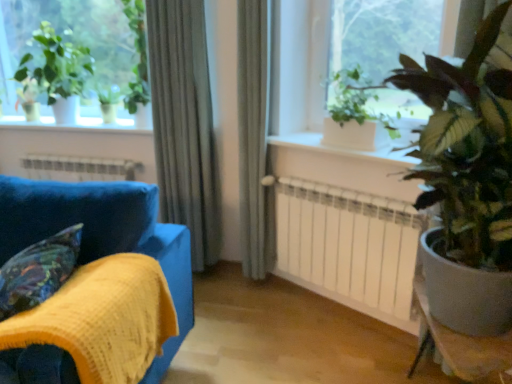
Identify the location of vacant location below satin fabric curtain at center, positioned as the first curtain in right-to-left order (from a real-world perspective). (251, 283).